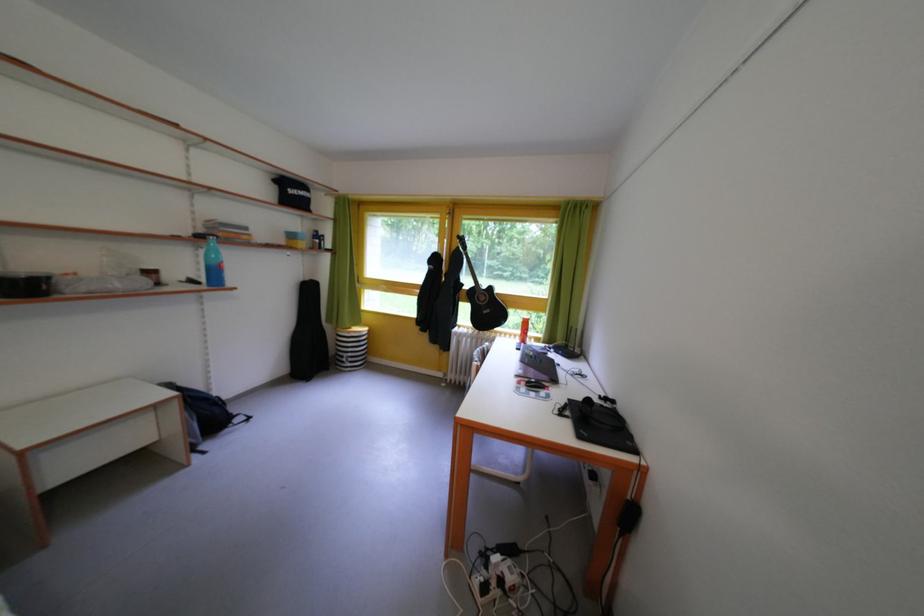
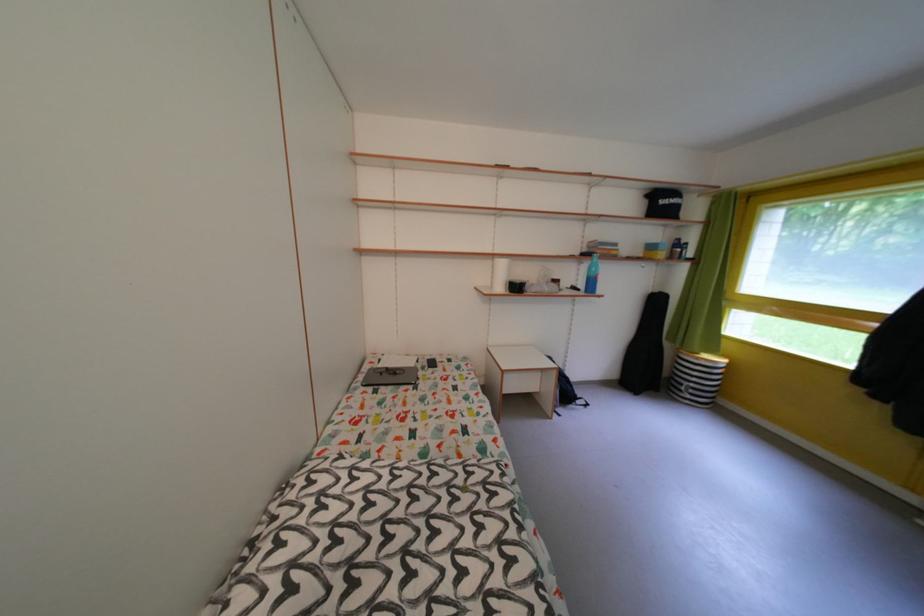
Where in the second image is the point corresponding to point 203,217 from the first image?

(592, 243)